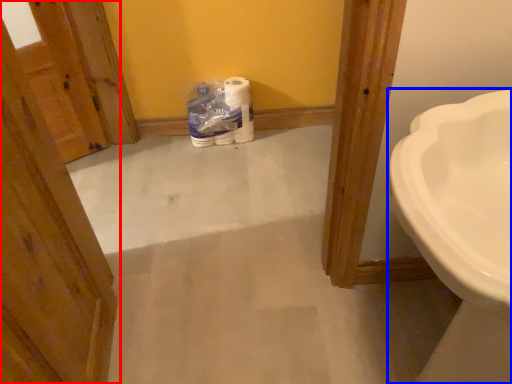
Question: Among these objects, which one is nearest to the camera, door (highlighted by a red box) or sink (highlighted by a blue box)?

Choices:
 (A) door
 (B) sink

Answer: (A)